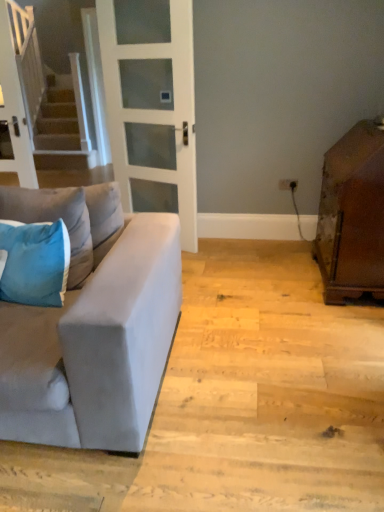
Image resolution: width=384 pixels, height=512 pixels. In order to click on free space in front of brown wooden cabinet at right in this screenshot , I will do `click(338, 329)`.